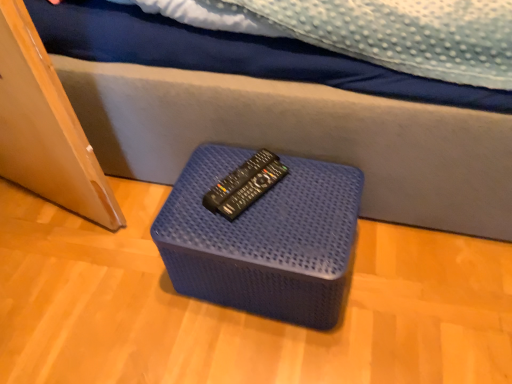
Question: Considering the relative sizes of black plastic remote at center and blue woven ottoman at center in the image provided, is black plastic remote at center taller than blue woven ottoman at center?

Choices:
 (A) yes
 (B) no

Answer: (B)

Question: Is black plastic remote at center far from blue woven ottoman at center?

Choices:
 (A) yes
 (B) no

Answer: (B)

Question: Is the position of black plastic remote at center less distant than that of blue woven ottoman at center?

Choices:
 (A) yes
 (B) no

Answer: (B)

Question: Can you confirm if black plastic remote at center is shorter than blue woven ottoman at center?

Choices:
 (A) no
 (B) yes

Answer: (B)

Question: From a real-world perspective, is black plastic remote at center on blue woven ottoman at center?

Choices:
 (A) yes
 (B) no

Answer: (A)

Question: Is black plastic remote at center positioned with its back to blue woven ottoman at center?

Choices:
 (A) no
 (B) yes

Answer: (A)

Question: Is blue woven ottoman at center wider than black plastic remote at center?

Choices:
 (A) yes
 (B) no

Answer: (A)

Question: Considering the relative sizes of blue woven ottoman at center and black plastic remote at center in the image provided, is blue woven ottoman at center thinner than black plastic remote at center?

Choices:
 (A) yes
 (B) no

Answer: (B)

Question: Does blue woven ottoman at center have a larger size compared to black plastic remote at center?

Choices:
 (A) yes
 (B) no

Answer: (A)

Question: Is blue woven ottoman at center oriented towards black plastic remote at center?

Choices:
 (A) yes
 (B) no

Answer: (B)

Question: Does blue woven ottoman at center lie behind black plastic remote at center?

Choices:
 (A) yes
 (B) no

Answer: (B)

Question: From a real-world perspective, is blue woven ottoman at center below black plastic remote at center?

Choices:
 (A) no
 (B) yes

Answer: (B)

Question: Is black plastic remote at center in front of or behind blue woven ottoman at center in the image?

Choices:
 (A) front
 (B) behind

Answer: (B)